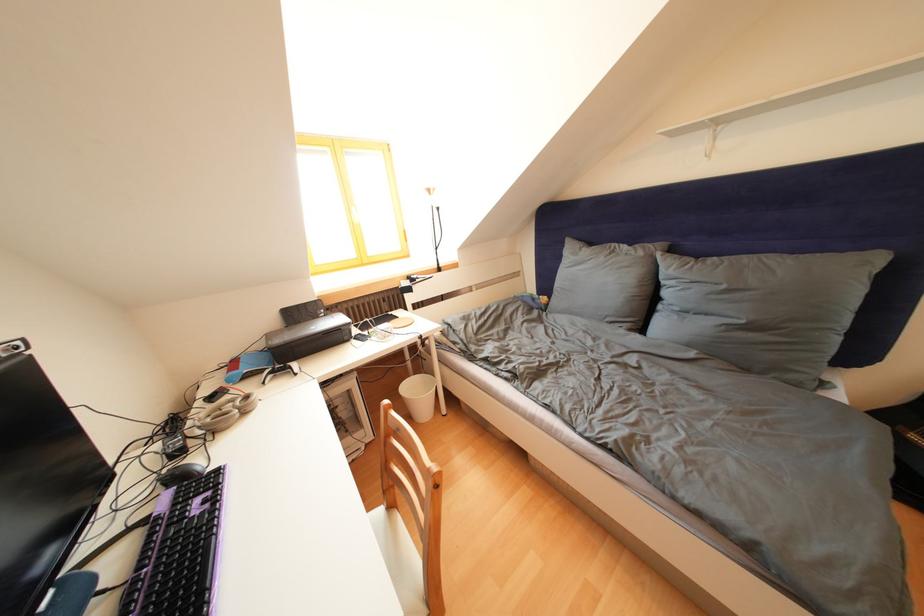
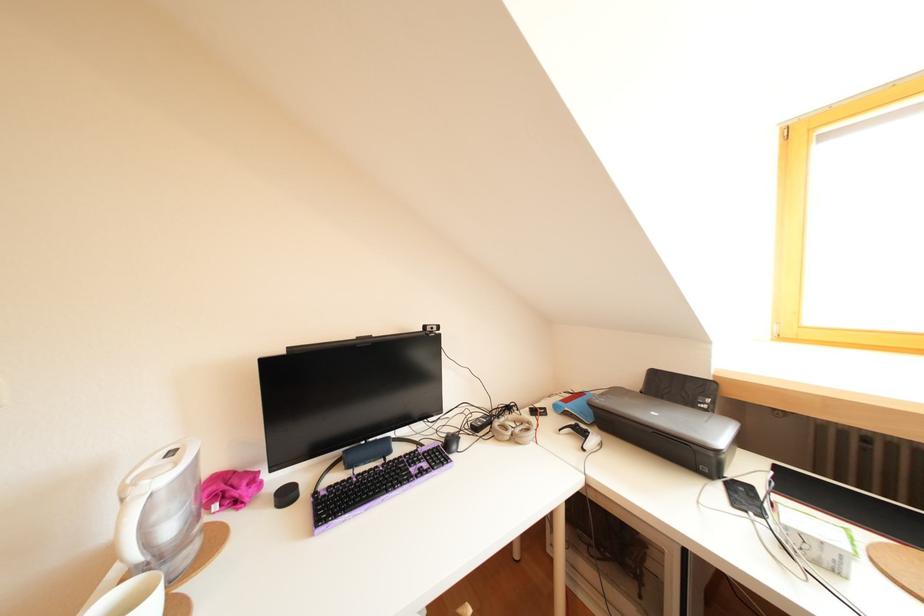
Question: The first image is from the beginning of the video and the second image is from the end. How did the camera likely rotate when shooting the video?

Choices:
 (A) Left
 (B) Right
 (C) Up
 (D) Down

Answer: (A)